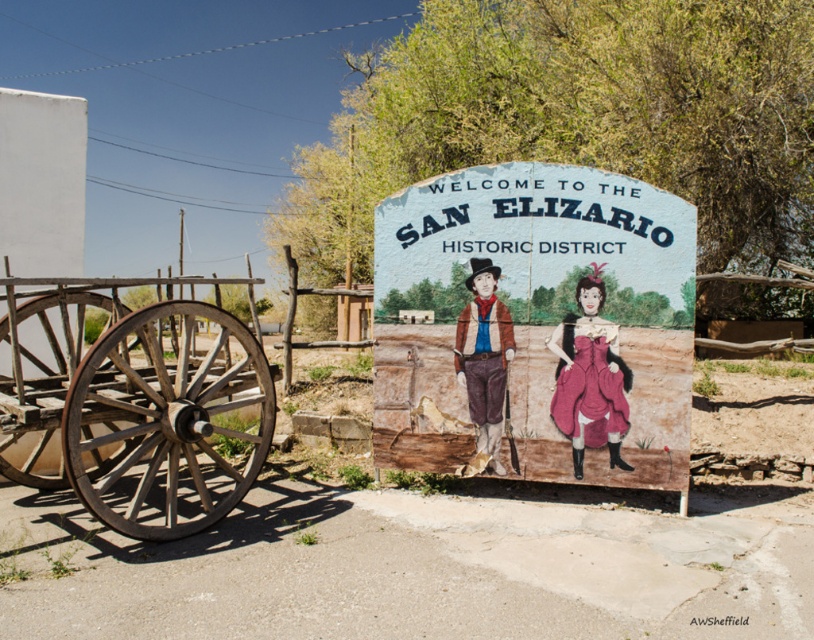
Question: Which point is farther to the camera?

Choices:
 (A) wooden wagon wheel at left
 (B) rustic wooden sign at center

Answer: (B)

Question: Can you confirm if rustic wooden sign at center is bigger than wooden wagon wheel at left?

Choices:
 (A) no
 (B) yes

Answer: (A)

Question: Does rustic wooden sign at center have a larger size compared to wooden wagon wheel at left?

Choices:
 (A) no
 (B) yes

Answer: (A)

Question: Can you confirm if rustic wooden sign at center is smaller than wooden wagon wheel at left?

Choices:
 (A) yes
 (B) no

Answer: (A)